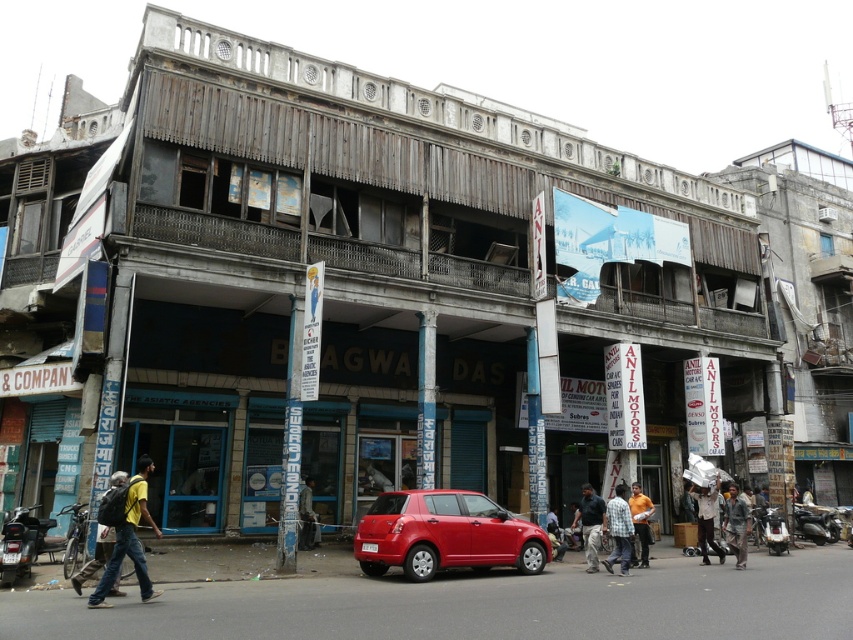
The width and height of the screenshot is (853, 640). In order to click on shiny red hatchback at center in this screenshot , I will do `click(444, 534)`.

Between shiny red hatchback at center and dark gray fabric jacket at center, which one appears on the left side from the viewer's perspective?

From the viewer's perspective, dark gray fabric jacket at center appears more on the left side.

Which is behind, point (415, 500) or point (305, 522)?

The point (305, 522) is more distant.

Where is `shiny red hatchback at center`? shiny red hatchback at center is located at coordinates (444, 534).

Is dark blue jeans at center below dark gray fabric jacket at center?

No, dark blue jeans at center is not below dark gray fabric jacket at center.

I want to click on dark blue jeans at center, so click(590, 524).

Is point (595, 556) farther from camera compared to point (300, 513)?

No, (595, 556) is closer to viewer.

The height and width of the screenshot is (640, 853). What are the coordinates of `dark blue jeans at center` in the screenshot? It's located at (590, 524).

Is white matte plastic bag at center positioned behind dark gray fabric jacket at center?

No, white matte plastic bag at center is in front of dark gray fabric jacket at center.

Does point (704, 561) come behind point (306, 540)?

No, it is not.

The width and height of the screenshot is (853, 640). I want to click on white matte plastic bag at center, so click(x=706, y=518).